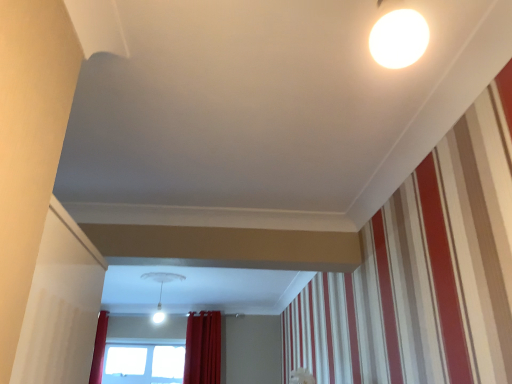
Question: From a real-world perspective, is red velvet curtain at lower center located higher than transparent glass window at lower center?

Choices:
 (A) no
 (B) yes

Answer: (B)

Question: Is red velvet curtain at lower center closer to camera compared to transparent glass window at lower center?

Choices:
 (A) yes
 (B) no

Answer: (A)

Question: Is red velvet curtain at lower center outside of transparent glass window at lower center?

Choices:
 (A) no
 (B) yes

Answer: (B)

Question: Can you confirm if red velvet curtain at lower center is thinner than transparent glass window at lower center?

Choices:
 (A) yes
 (B) no

Answer: (B)

Question: From a real-world perspective, is red velvet curtain at lower center beneath transparent glass window at lower center?

Choices:
 (A) yes
 (B) no

Answer: (B)

Question: Is red velvet curtain at lower center spatially inside white glossy light fixture at center, or outside of it?

Choices:
 (A) outside
 (B) inside

Answer: (A)

Question: From the image's perspective, is red velvet curtain at lower center above or below white glossy light fixture at center?

Choices:
 (A) below
 (B) above

Answer: (A)

Question: From a real-world perspective, is red velvet curtain at lower center positioned above or below white glossy light fixture at center?

Choices:
 (A) below
 (B) above

Answer: (A)

Question: In the image, is red velvet curtain at lower center positioned in front of or behind white glossy light fixture at center?

Choices:
 (A) front
 (B) behind

Answer: (B)

Question: Visually, is transparent glass window at lower center positioned to the left or to the right of red velvet curtain at lower center?

Choices:
 (A) right
 (B) left

Answer: (B)

Question: Considering their positions, is transparent glass window at lower center located in front of or behind red velvet curtain at lower center?

Choices:
 (A) behind
 (B) front

Answer: (A)

Question: From the image's perspective, is transparent glass window at lower center above or below red velvet curtain at lower center?

Choices:
 (A) above
 (B) below

Answer: (B)

Question: Is point (164, 372) closer or farther from the camera than point (210, 362)?

Choices:
 (A) closer
 (B) farther

Answer: (B)

Question: From the image's perspective, is red velvet curtain at lower center above or below transparent glass window at lower center?

Choices:
 (A) below
 (B) above

Answer: (B)

Question: Visually, is red velvet curtain at lower center positioned to the left or to the right of transparent glass window at lower center?

Choices:
 (A) left
 (B) right

Answer: (B)